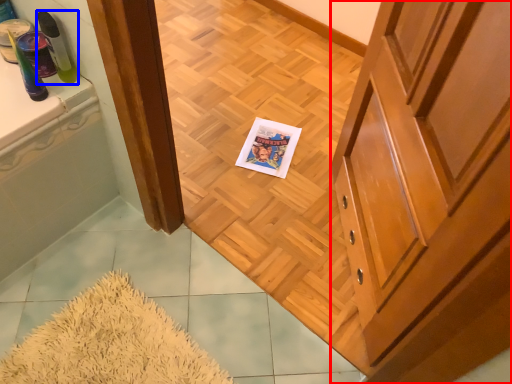
Question: Which point is further to the camera, cabinetry (highlighted by a red box) or toiletry (highlighted by a blue box)?

Choices:
 (A) cabinetry
 (B) toiletry

Answer: (B)